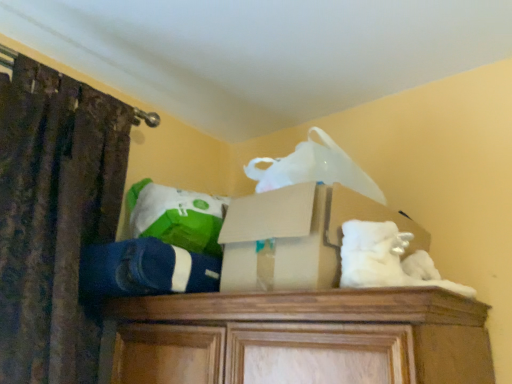
Measure the distance between point (326, 211) and camera.

The depth of point (326, 211) is 88.00 centimeters.

Where is `cardboard box at upper center`? The height and width of the screenshot is (384, 512). cardboard box at upper center is located at coordinates (297, 236).

The width and height of the screenshot is (512, 384). Describe the element at coordinates (297, 236) in the screenshot. I see `cardboard box at upper center` at that location.

The height and width of the screenshot is (384, 512). What are the coordinates of `cardboard box at upper center` in the screenshot? It's located at (297, 236).